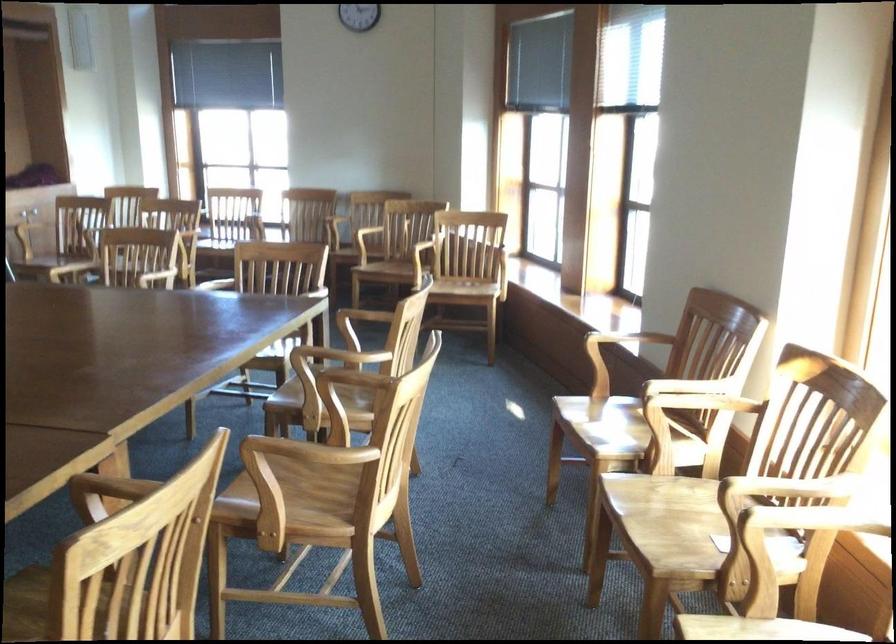
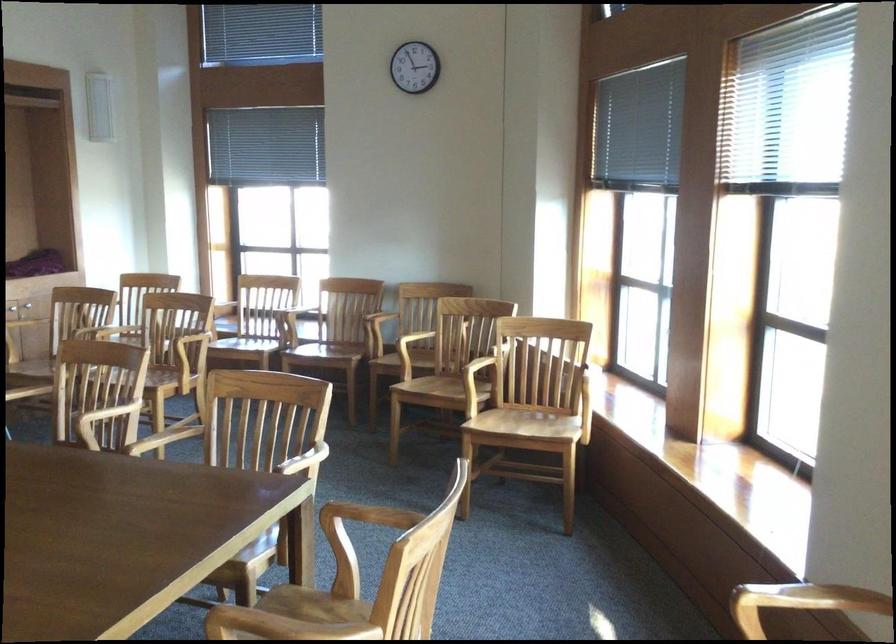
Question: In a continuous first-person perspective shot, in which direction is the camera moving?

Choices:
 (A) Left
 (B) Right
 (C) Forward
 (D) Backward

Answer: (C)